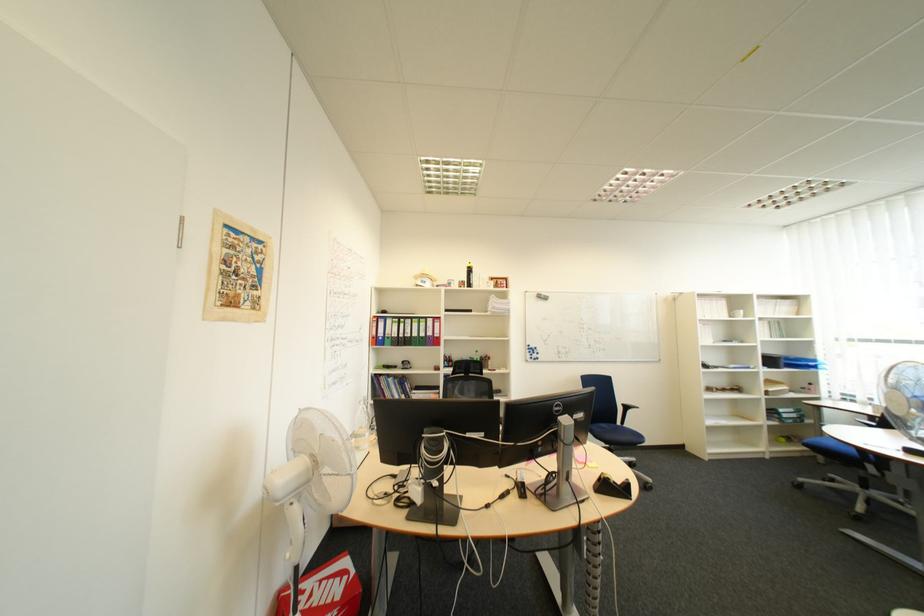
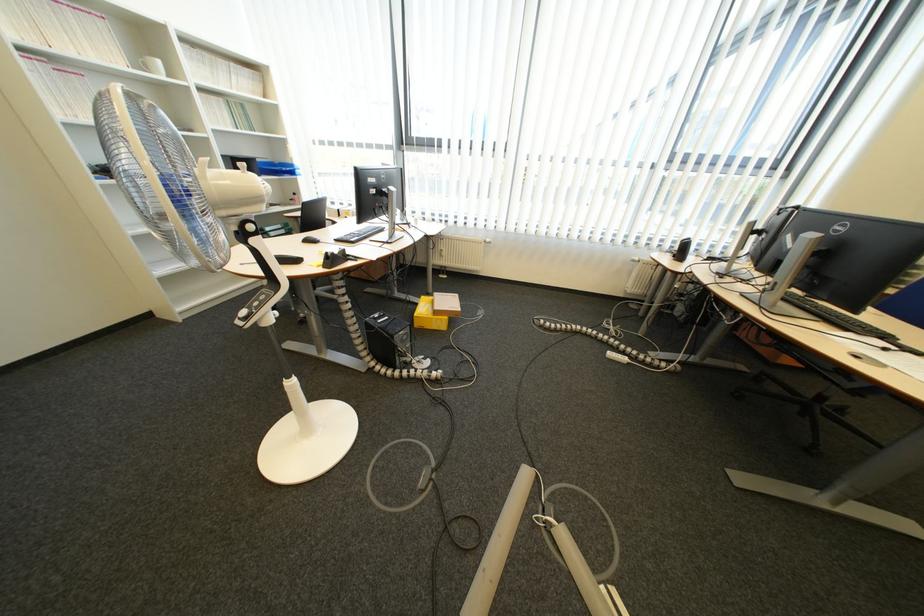
The point at (805, 358) is marked in the first image. Where is the corresponding point in the second image?

(289, 163)